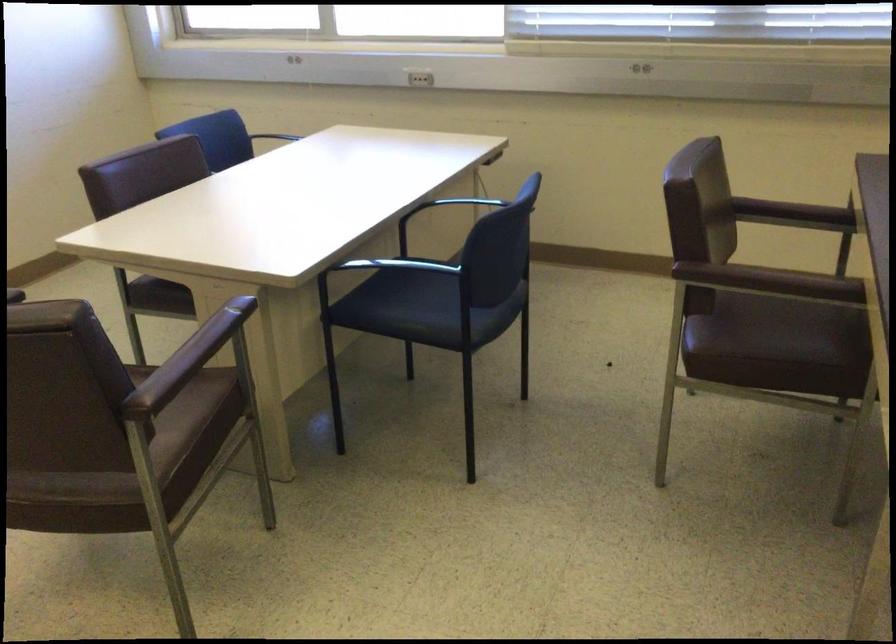
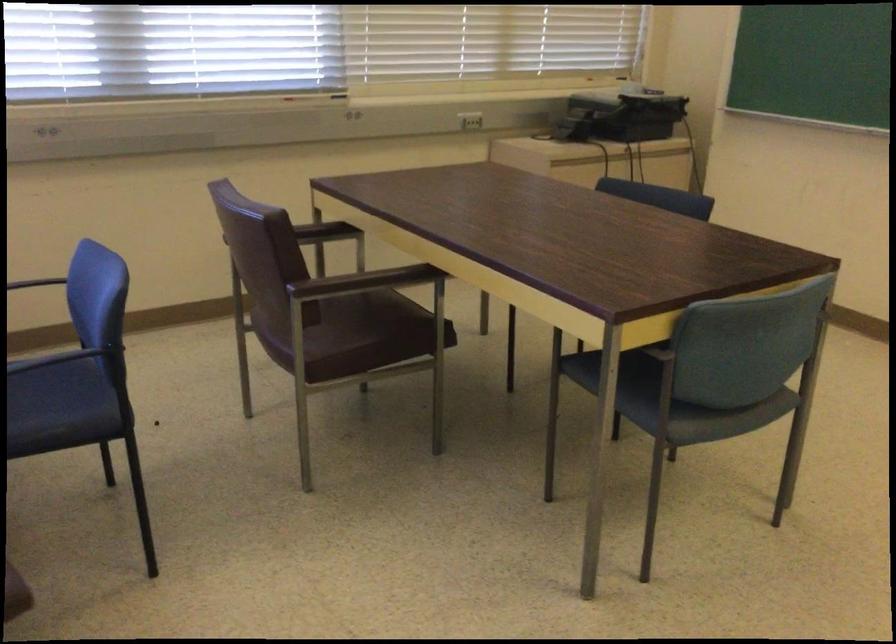
Locate, in the second image, the point that corresponds to [777,337] in the first image.

(371, 330)